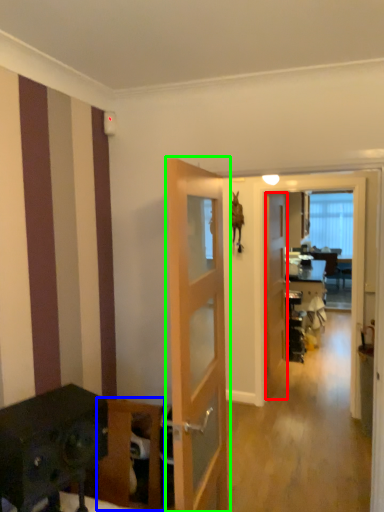
Question: Based on their relative distances, which object is farther from door (highlighted by a red box)? Choose from furniture (highlighted by a blue box) and door (highlighted by a green box).

Choices:
 (A) furniture
 (B) door

Answer: (A)